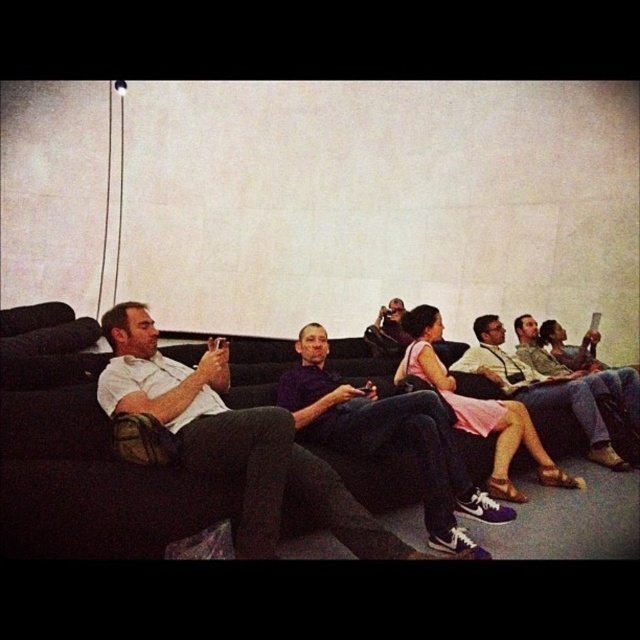
You are a personal trainer who wants to approach both the purple matte shirt at center and the matte white shirt at center for a quick fitness consultation. Given that you can only move 5 feet between them, can you reach both individuals without exceeding your movement limit?

The distance between the purple matte shirt at center and the matte white shirt at center is 5.62 feet, which is slightly more than the 5 feet movement limit. Therefore, you cannot reach both individuals without exceeding the movement limit.

From the picture: You are standing at the point with coordinates point (362,445) and want to take a photo of the entire seating area. You have a camera that has a maximum focus range of 10 feet. Will the camera be able to capture the entire seating area clearly?

The distance between point (362,445) and the camera is 9.63 feet, which is within the camera maximum focus range of 10 feet. Therefore, the camera can capture the entire seating area clearly.

You are standing in the lounge and want to take a photo of both point (276, 419) and point (417, 428) in the image. Which point should you focus on first to ensure both are in clear view?

You should focus on point (276, 419) first because it is closer to the camera than point (417, 428). By focusing on the closer point, both points will be in clear view due to the depth of field.